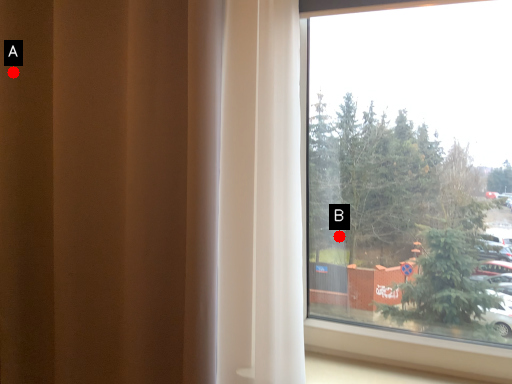
Question: Two points are circled on the image, labeled by A and B beside each circle. Which point appears farthest from the camera in this image?

Choices:
 (A) A is further
 (B) B is further

Answer: (B)